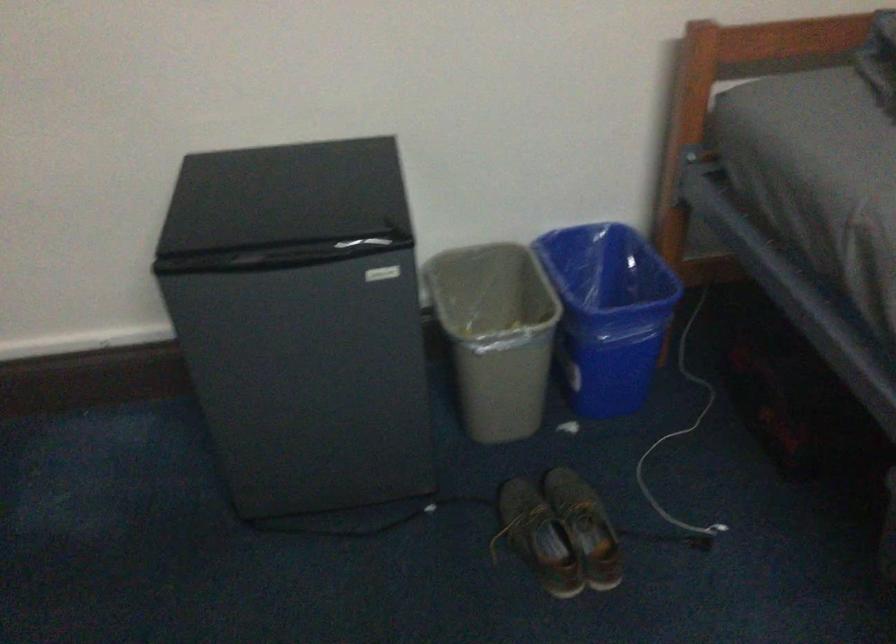
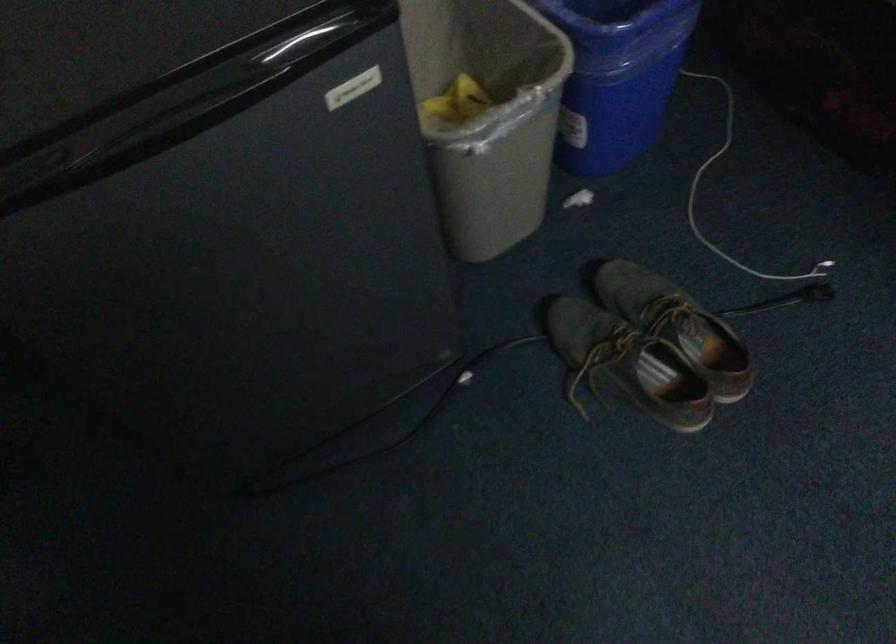
Find the pixel in the second image that matches (x=570, y=514) in the first image.

(662, 323)